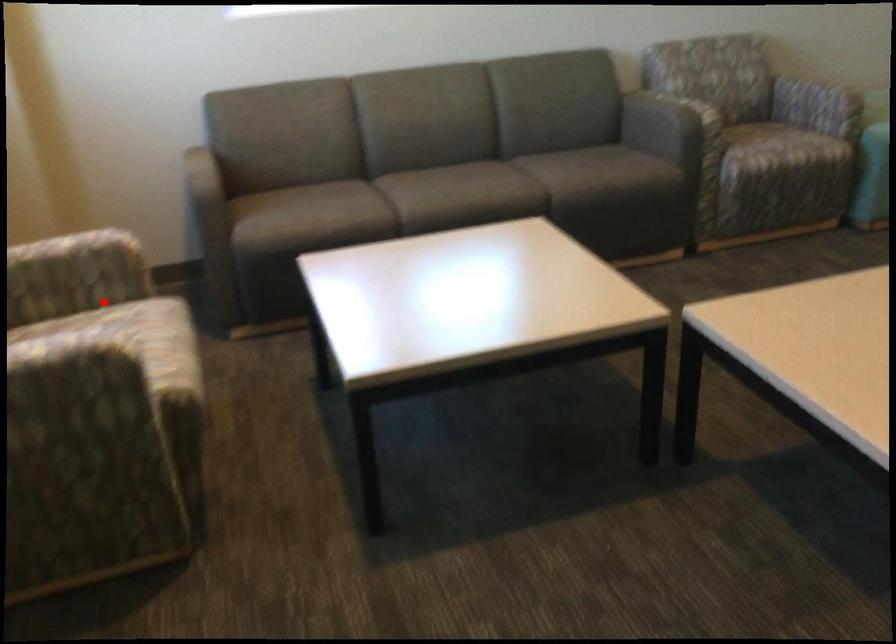
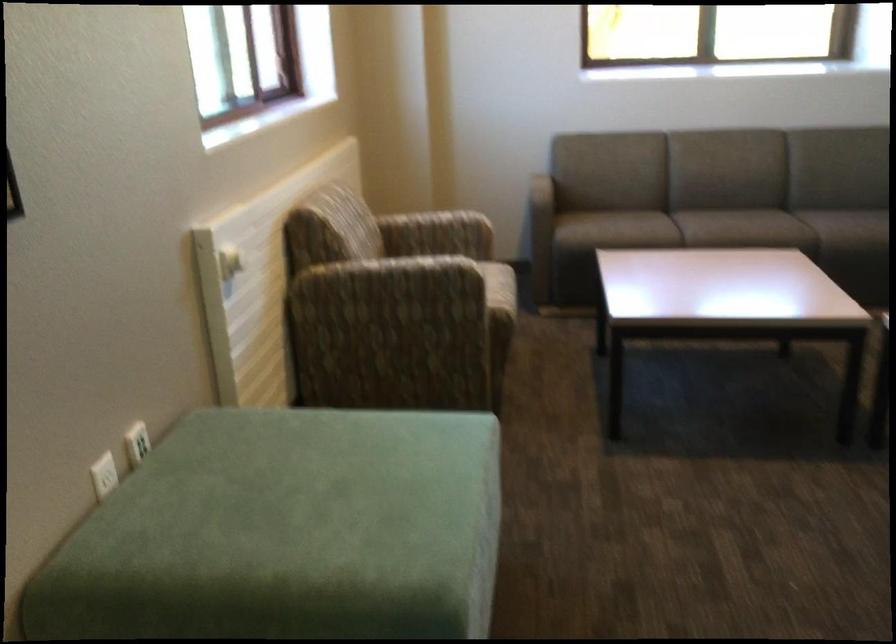
Question: I am providing you with two images of the same scene from different viewpoints. A red point is shown in image1. For the corresponding object point in image2, is it positioned nearer or farther from the camera?

Choices:
 (A) Nearer
 (B) Farther

Answer: (B)